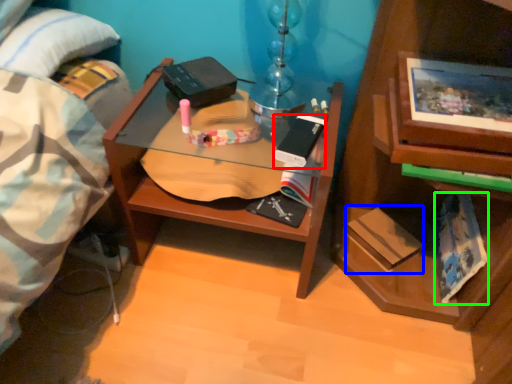
Question: Estimate the real-world distances between objects in this image. Which object is closer to paperback book (highlighted by a red box), paperback book (highlighted by a blue box) or paperback book (highlighted by a green box)?

Choices:
 (A) paperback book
 (B) paperback book

Answer: (A)